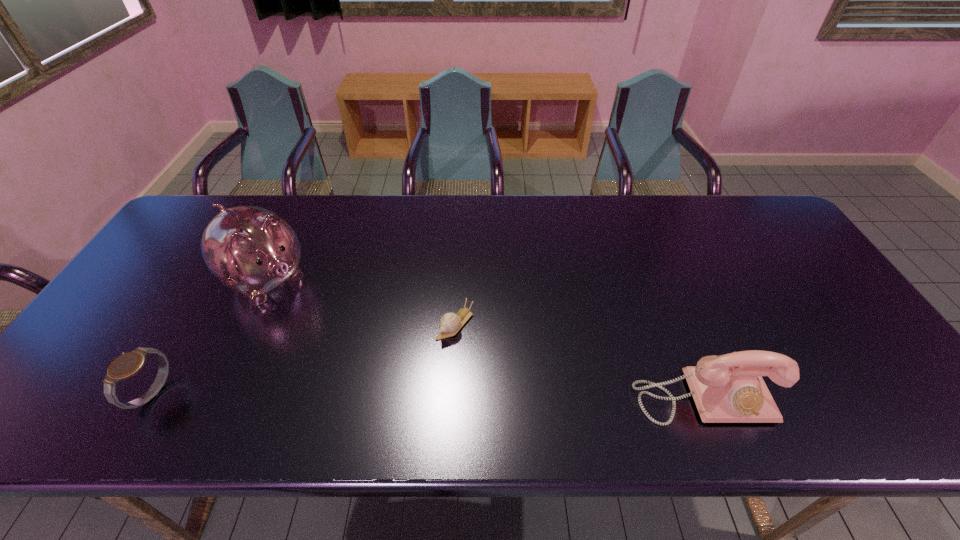
You are a GUI agent. You are given a task and a screenshot of the screen. Output one action in this format:
    pyautogui.click(x=<x>, y=<y>)
    Task: Click on the free location located 0.190m on the front facing side of the tallest object
    The height and width of the screenshot is (540, 960).
    Given the screenshot: What is the action you would take?
    pyautogui.click(x=337, y=334)

Identify the location of watch present at the near edge. The width and height of the screenshot is (960, 540). (125, 366).

Locate an element on the screen. telephone that is positioned at the near edge is located at coordinates (729, 388).

Find the location of `vacant space at the far edge of the desktop`. vacant space at the far edge of the desktop is located at coordinates (554, 220).

Identify the location of free space at the near edge. (336, 391).

In the image, there is a desktop. At what (x,y) coordinates should I click in order to perform the action: click on vacant space at the right edge. Please return your answer as a coordinate pair (x, y). This screenshot has height=540, width=960. Looking at the image, I should click on (789, 256).

Locate an element on the screen. This screenshot has width=960, height=540. vacant region at the far left corner of the desktop is located at coordinates (190, 223).

Identify the location of vacant space at the far right corner of the desktop. This screenshot has width=960, height=540. (742, 234).

This screenshot has width=960, height=540. Find the location of `vacant area between the second tallest object and the watch`. vacant area between the second tallest object and the watch is located at coordinates (428, 395).

Locate an element on the screen. This screenshot has width=960, height=540. free spot between the escargot and the second shortest object is located at coordinates (303, 359).